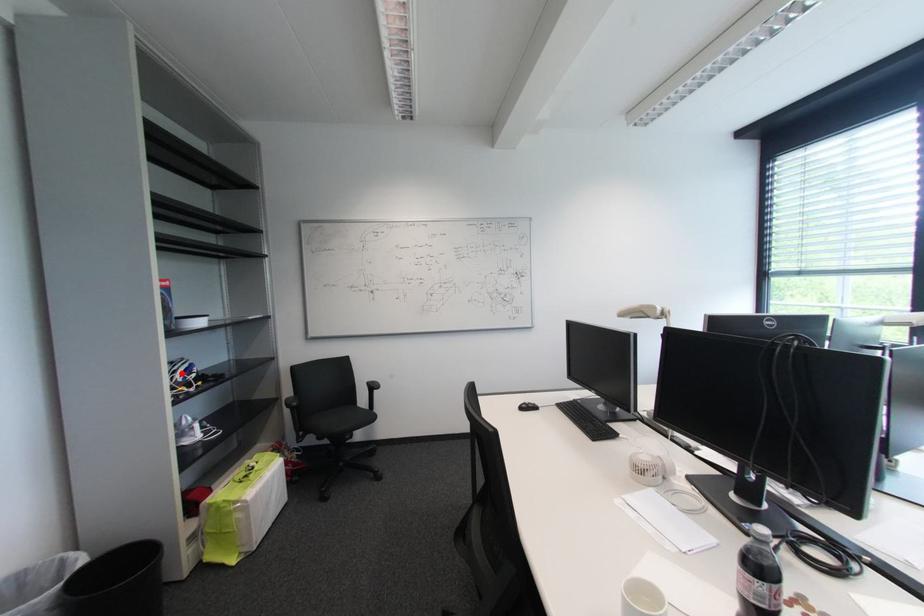
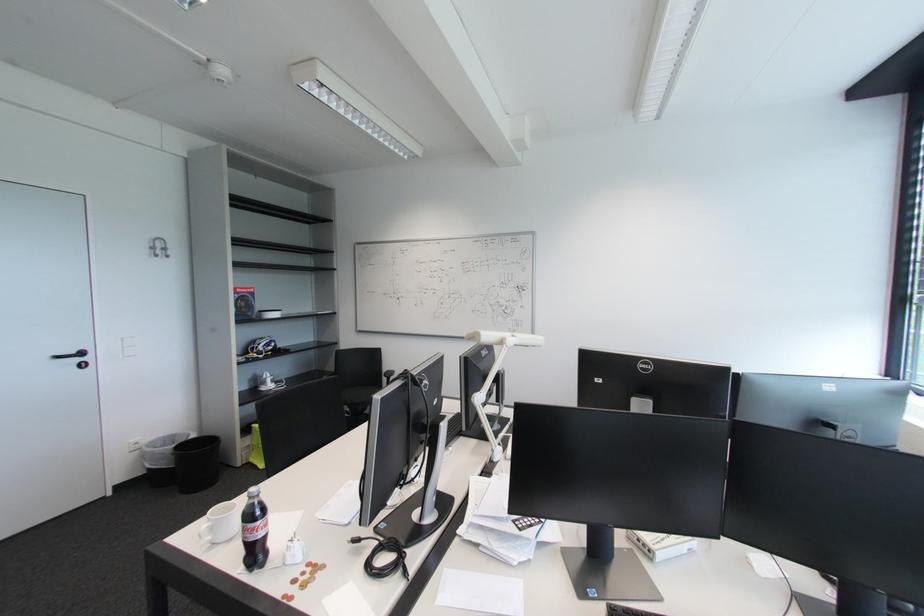
In the second image, find the point that corresponds to the highlighted location in the first image.

(265, 346)